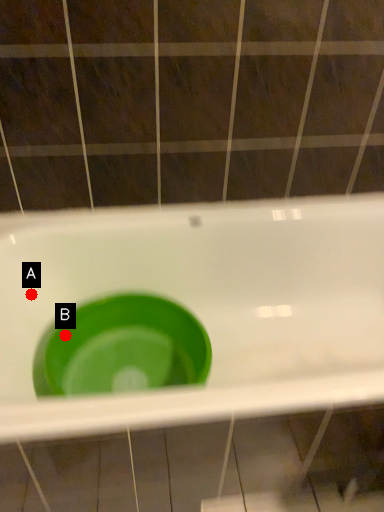
Question: Two points are circled on the image, labeled by A and B beside each circle. Which of the following is the closest to the observer?

Choices:
 (A) A is closer
 (B) B is closer

Answer: (B)